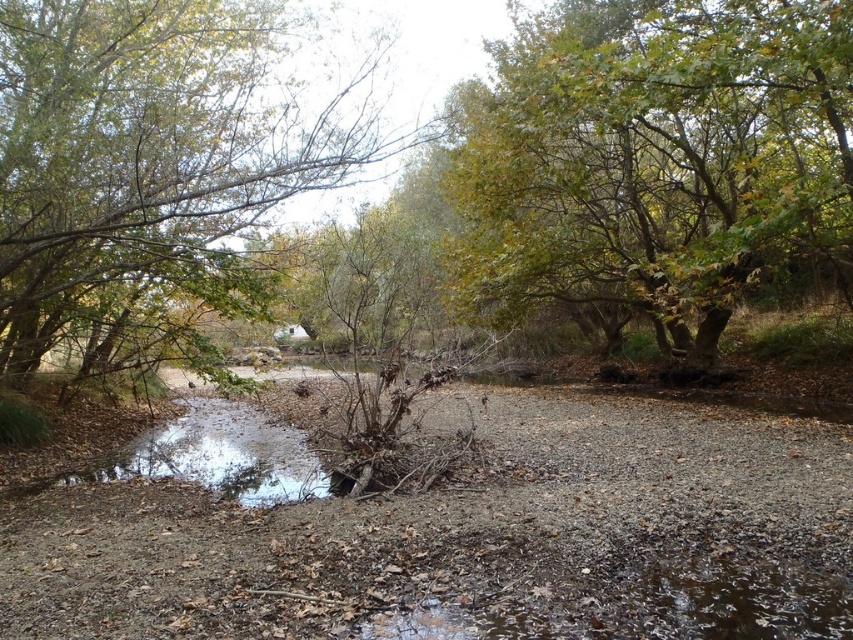
Between point (515, 168) and point (212, 429), which one is positioned in front?

Point (212, 429) is in front.

You are a GUI agent. You are given a task and a screenshot of the screen. Output one action in this format:
    pyautogui.click(x=<x>, y=<y>)
    Task: Click on the green leafy tree at center
    This screenshot has height=640, width=853.
    Given the screenshot: What is the action you would take?
    pyautogui.click(x=656, y=157)

Which is in front, point (479, 157) or point (120, 476)?

Positioned in front is point (120, 476).

This screenshot has height=640, width=853. Identify the location of green leafy tree at center. (656, 157).

Does green leafy tree at center appear on the right side of green leafy tree at upper left?

Yes, green leafy tree at center is to the right of green leafy tree at upper left.

Measure the distance between point (793, 60) and camera.

They are 7.55 meters apart.

The height and width of the screenshot is (640, 853). I want to click on green leafy tree at center, so click(656, 157).

Who is positioned more to the right, green leafy tree at upper left or clear water at center?

green leafy tree at upper left is more to the right.

This screenshot has width=853, height=640. What do you see at coordinates (149, 160) in the screenshot? I see `green leafy tree at upper left` at bounding box center [149, 160].

This screenshot has height=640, width=853. Identify the location of green leafy tree at upper left. (149, 160).